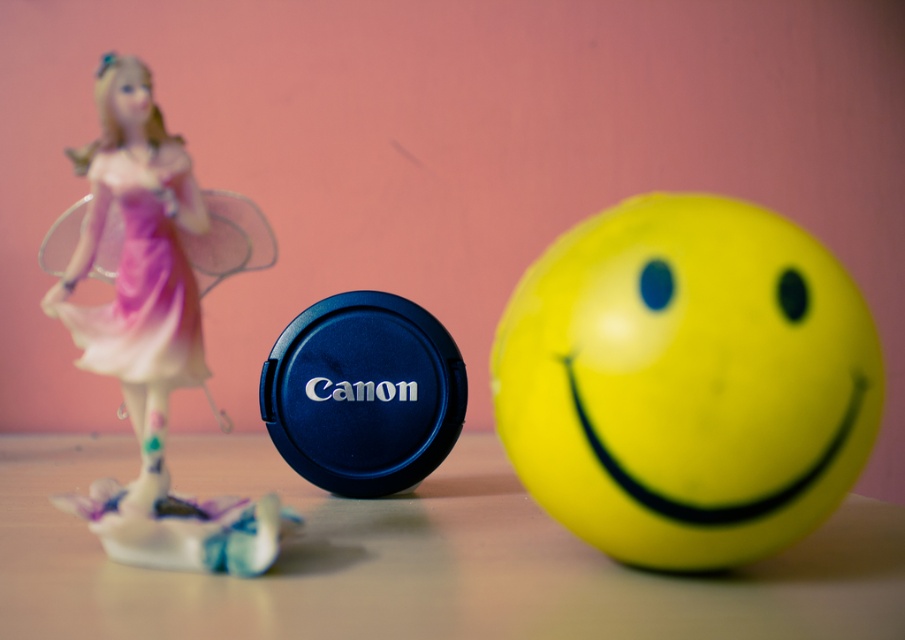
You are an interior designer arranging items on a shelf. You have a translucent plastic fairy at left and a translucent plastic face at upper left. Which object should you place closer to the front of the shelf to ensure both are visible?

You should place the translucent plastic fairy at left closer to the front of the shelf because it is taller than the translucent plastic face at upper left, allowing both objects to be visible without one blocking the other.